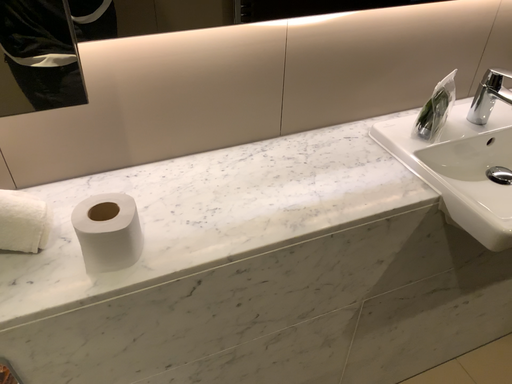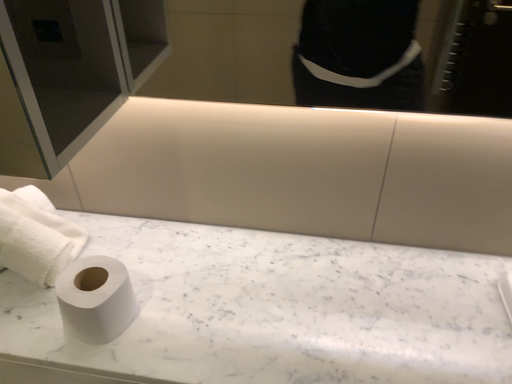
Question: How did the camera likely rotate when shooting the video?

Choices:
 (A) rotated downward
 (B) rotated upward

Answer: (B)